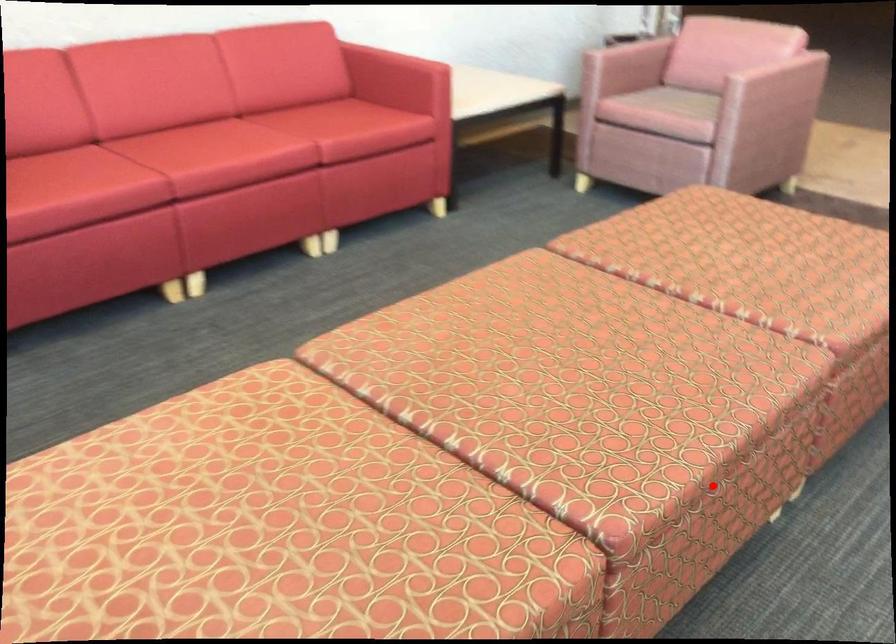
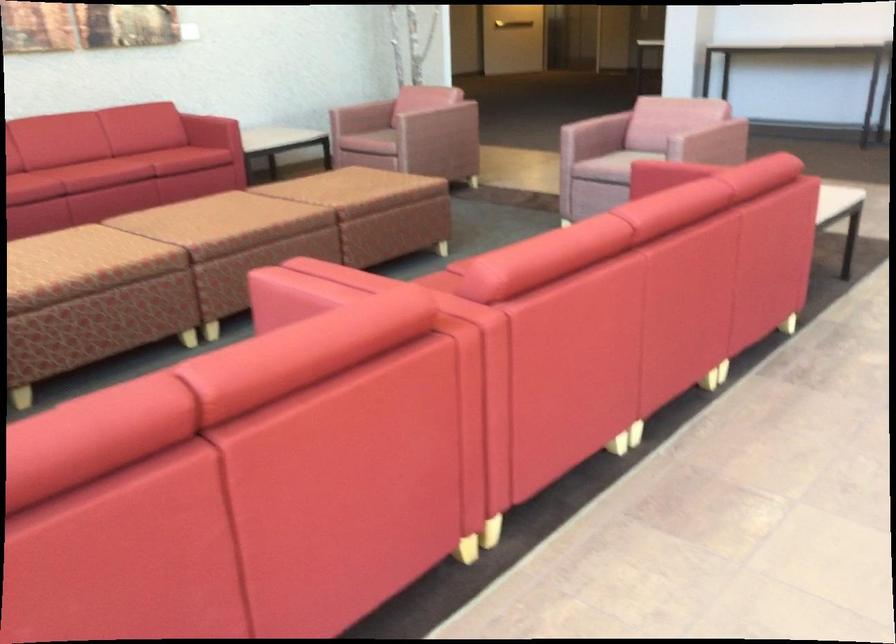
In the second image, find the point that corresponds to the highlighted location in the first image.

(254, 234)